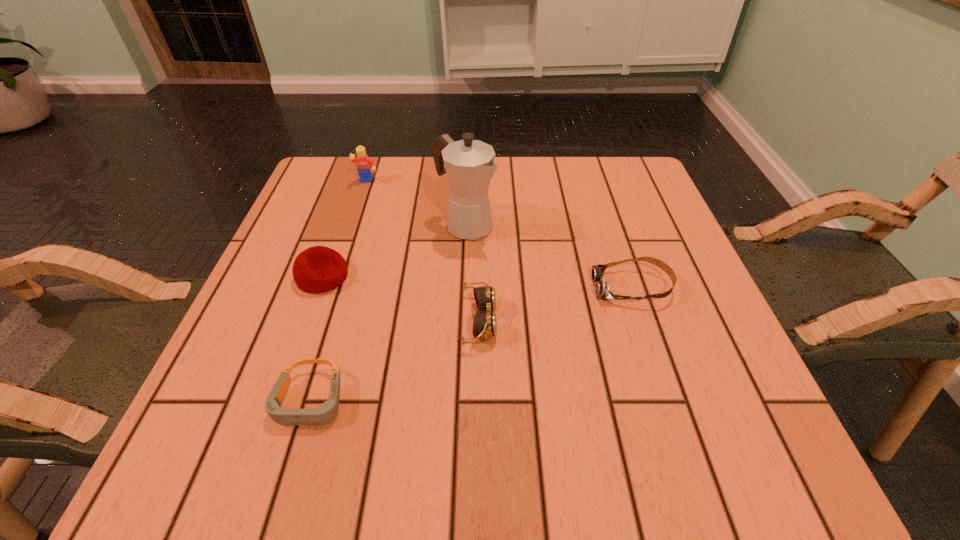
Find the location of `the tallest object`. the tallest object is located at coordinates (469, 164).

You are a GUI agent. You are given a task and a screenshot of the screen. Output one action in this format:
    pyautogui.click(x=<x>, y=<y>)
    Task: Click on the fifth nearest object
    This screenshot has height=540, width=960.
    Given the screenshot: What is the action you would take?
    pyautogui.click(x=469, y=164)

Where is `Lego`? This screenshot has width=960, height=540. Lego is located at coordinates (364, 163).

At what (x,y) coordinates should I click in order to perform the action: click on the farthest object. Please return your answer as a coordinate pair (x, y). Image resolution: width=960 pixels, height=540 pixels. Looking at the image, I should click on (364, 163).

Find the location of a particular element. beanbag is located at coordinates (318, 269).

Image resolution: width=960 pixels, height=540 pixels. Find the location of `the second goggles from left to right`. the second goggles from left to right is located at coordinates (485, 325).

Where is `the rightmost goggles`? The width and height of the screenshot is (960, 540). the rightmost goggles is located at coordinates (602, 290).

Identify the location of the leftmost goggles. The image size is (960, 540). (326, 412).

Identify the location of the nearest goggles. The height and width of the screenshot is (540, 960). (326, 412).

Locate an element on the screen. Image resolution: width=960 pixels, height=540 pixels. vacant space located 0.400m on the right of the coffeepot is located at coordinates coord(670,224).